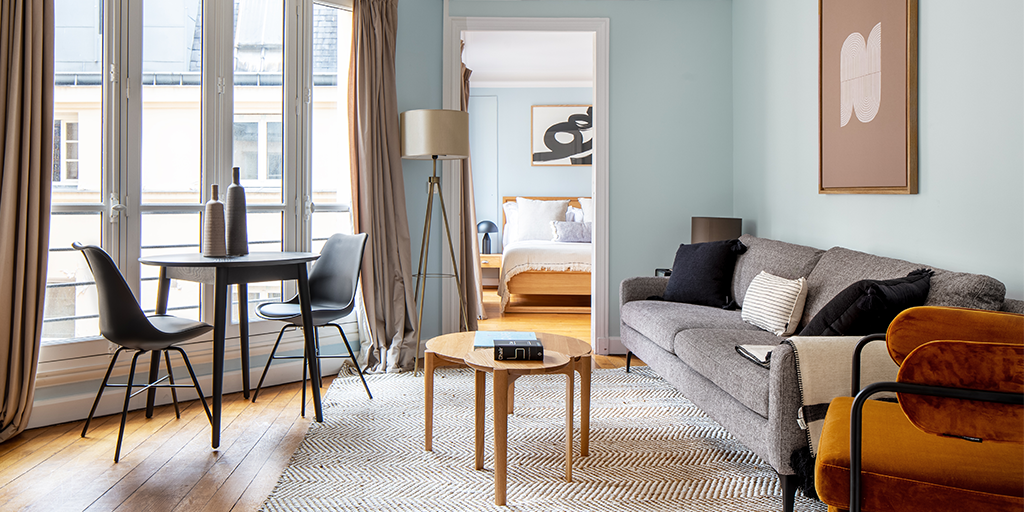
I want to click on easy chair, so click(x=889, y=449).